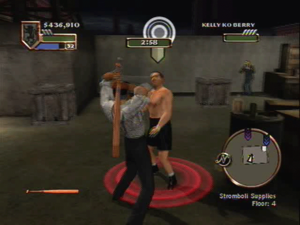
Find the location of a particular element. The width and height of the screenshot is (300, 225). wall is located at coordinates (204, 70).